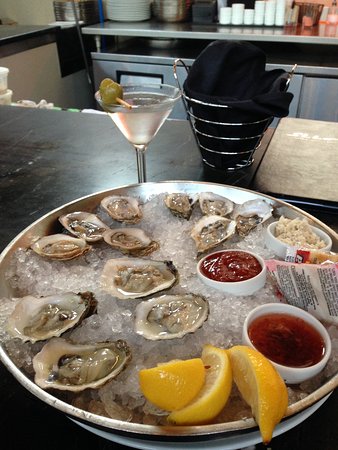
Where is `empty space on table`? The width and height of the screenshot is (338, 450). empty space on table is located at coordinates (23, 135).